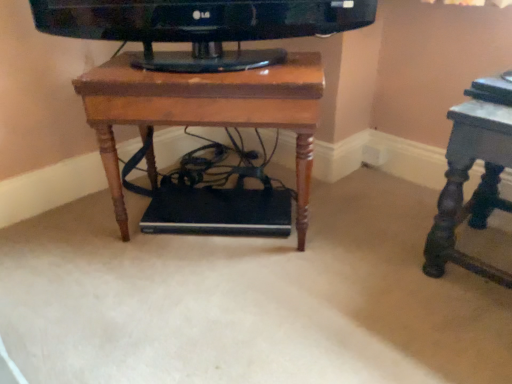
You are a GUI agent. You are given a task and a screenshot of the screen. Output one action in this format:
    pyautogui.click(x=<x>, y=<y>)
    Task: Click on the dark gray polished wood table at right, positioned as the first table in right-to-left order
    This screenshot has width=512, height=384.
    Given the screenshot: What is the action you would take?
    pyautogui.click(x=477, y=187)

What do you see at coordinates (477, 187) in the screenshot? I see `dark gray polished wood table at right, which is counted as the second table, starting from the left` at bounding box center [477, 187].

This screenshot has width=512, height=384. What do you see at coordinates (205, 110) in the screenshot?
I see `wooden table at center, arranged as the first table when viewed from the left` at bounding box center [205, 110].

You are a GUI agent. You are given a task and a screenshot of the screen. Output one action in this format:
    pyautogui.click(x=<x>, y=<y>)
    Task: Click on the wooden table at center, arranged as the 2th table when viewed from the right
    
    Given the screenshot: What is the action you would take?
    205,110

Find the location of a particular element. dark gray polished wood table at right, which is counted as the second table, starting from the left is located at coordinates (477, 187).

Considering the relative positions of wooden table at center, arranged as the first table when viewed from the left, and dark gray polished wood table at right, which is counted as the second table, starting from the left, in the image provided, is wooden table at center, arranged as the first table when viewed from the left, to the left or to the right of dark gray polished wood table at right, which is counted as the second table, starting from the left,?

wooden table at center, arranged as the first table when viewed from the left, is to the left of dark gray polished wood table at right, which is counted as the second table, starting from the left.

Considering the relative positions of wooden table at center, arranged as the 2th table when viewed from the right, and dark gray polished wood table at right, which is counted as the second table, starting from the left, in the image provided, is wooden table at center, arranged as the 2th table when viewed from the right, in front of dark gray polished wood table at right, which is counted as the second table, starting from the left,?

No, wooden table at center, arranged as the 2th table when viewed from the right, is further to the viewer.

Is point (309, 153) closer or farther from the camera than point (462, 161)?

Clearly, point (309, 153) is more distant from the camera than point (462, 161).

From the image's perspective, is wooden table at center, arranged as the first table when viewed from the left, above or below dark gray polished wood table at right, positioned as the first table in right-to-left order?

Based on their image positions, wooden table at center, arranged as the first table when viewed from the left, is located above dark gray polished wood table at right, positioned as the first table in right-to-left order.

From a real-world perspective, which is physically above, wooden table at center, arranged as the 2th table when viewed from the right, or dark gray polished wood table at right, which is counted as the second table, starting from the left?

wooden table at center, arranged as the 2th table when viewed from the right.

Can you confirm if wooden table at center, arranged as the 2th table when viewed from the right, is thinner than dark gray polished wood table at right, which is counted as the second table, starting from the left?

Incorrect, the width of wooden table at center, arranged as the 2th table when viewed from the right, is not less than that of dark gray polished wood table at right, which is counted as the second table, starting from the left.

Does wooden table at center, arranged as the 2th table when viewed from the right, have a lesser height compared to dark gray polished wood table at right, which is counted as the second table, starting from the left?

In fact, wooden table at center, arranged as the 2th table when viewed from the right, may be taller than dark gray polished wood table at right, which is counted as the second table, starting from the left.

Who is bigger, wooden table at center, arranged as the first table when viewed from the left, or dark gray polished wood table at right, positioned as the first table in right-to-left order?

Bigger between the two is wooden table at center, arranged as the first table when viewed from the left.

Is wooden table at center, arranged as the 2th table when viewed from the right, spatially inside dark gray polished wood table at right, which is counted as the second table, starting from the left, or outside of it?

wooden table at center, arranged as the 2th table when viewed from the right, is not enclosed by dark gray polished wood table at right, which is counted as the second table, starting from the left.

Would you say wooden table at center, arranged as the 2th table when viewed from the right, is a long distance from dark gray polished wood table at right, positioned as the first table in right-to-left order?

No, wooden table at center, arranged as the 2th table when viewed from the right, is not far away from dark gray polished wood table at right, positioned as the first table in right-to-left order.

Does wooden table at center, arranged as the first table when viewed from the left, turn towards dark gray polished wood table at right, which is counted as the second table, starting from the left?

No, wooden table at center, arranged as the first table when viewed from the left, is not turned towards dark gray polished wood table at right, which is counted as the second table, starting from the left.

How distant is wooden table at center, arranged as the first table when viewed from the left, from dark gray polished wood table at right, positioned as the first table in right-to-left order?

wooden table at center, arranged as the first table when viewed from the left, is 18.65 inches from dark gray polished wood table at right, positioned as the first table in right-to-left order.

Locate an element on the screen. Image resolution: width=512 pixels, height=384 pixels. table behind the dark gray polished wood table at right, which is counted as the second table, starting from the left is located at coordinates (205, 110).

Does dark gray polished wood table at right, positioned as the first table in right-to-left order, appear on the left side of wooden table at center, arranged as the first table when viewed from the left?

Incorrect, dark gray polished wood table at right, positioned as the first table in right-to-left order, is not on the left side of wooden table at center, arranged as the first table when viewed from the left.

In the image, is dark gray polished wood table at right, which is counted as the second table, starting from the left, positioned in front of or behind wooden table at center, arranged as the 2th table when viewed from the right?

Visually, dark gray polished wood table at right, which is counted as the second table, starting from the left, is located in front of wooden table at center, arranged as the 2th table when viewed from the right.

Does point (436, 266) appear closer or farther from the camera than point (273, 85)?

Clearly, point (436, 266) is more distant from the camera than point (273, 85).

From the image's perspective, is dark gray polished wood table at right, positioned as the first table in right-to-left order, located beneath wooden table at center, arranged as the first table when viewed from the left?

Yes, from the image's perspective, dark gray polished wood table at right, positioned as the first table in right-to-left order, is beneath wooden table at center, arranged as the first table when viewed from the left.

From a real-world perspective, is dark gray polished wood table at right, which is counted as the second table, starting from the left, located beneath wooden table at center, arranged as the first table when viewed from the left?

Correct, in the physical world, dark gray polished wood table at right, which is counted as the second table, starting from the left, is lower than wooden table at center, arranged as the first table when viewed from the left.

Considering the relative sizes of dark gray polished wood table at right, which is counted as the second table, starting from the left, and wooden table at center, arranged as the 2th table when viewed from the right, in the image provided, is dark gray polished wood table at right, which is counted as the second table, starting from the left, thinner than wooden table at center, arranged as the 2th table when viewed from the right,?

Yes, dark gray polished wood table at right, which is counted as the second table, starting from the left, is thinner than wooden table at center, arranged as the 2th table when viewed from the right.

Can you confirm if dark gray polished wood table at right, positioned as the first table in right-to-left order, is shorter than wooden table at center, arranged as the first table when viewed from the left?

Result: Yes.

Consider the image. In terms of size, does dark gray polished wood table at right, positioned as the first table in right-to-left order, appear bigger or smaller than wooden table at center, arranged as the 2th table when viewed from the right?

Clearly, dark gray polished wood table at right, positioned as the first table in right-to-left order, is smaller in size than wooden table at center, arranged as the 2th table when viewed from the right.

Would you say dark gray polished wood table at right, positioned as the first table in right-to-left order, is outside wooden table at center, arranged as the 2th table when viewed from the right?

Yes, dark gray polished wood table at right, positioned as the first table in right-to-left order, is outside of wooden table at center, arranged as the 2th table when viewed from the right.

Are dark gray polished wood table at right, which is counted as the second table, starting from the left, and wooden table at center, arranged as the first table when viewed from the left, making contact?

No.

Is dark gray polished wood table at right, positioned as the first table in right-to-left order, aimed at wooden table at center, arranged as the 2th table when viewed from the right?

No.

Looking at this image, how much distance is there between dark gray polished wood table at right, positioned as the first table in right-to-left order, and wooden table at center, arranged as the first table when viewed from the left?

The distance of dark gray polished wood table at right, positioned as the first table in right-to-left order, from wooden table at center, arranged as the first table when viewed from the left, is 18.65 inches.

The height and width of the screenshot is (384, 512). I want to click on table in front of the wooden table at center, arranged as the first table when viewed from the left, so click(477, 187).

This screenshot has height=384, width=512. Find the location of `table that is in front of the wooden table at center, arranged as the first table when viewed from the left`. table that is in front of the wooden table at center, arranged as the first table when viewed from the left is located at coordinates (477, 187).

Where is `table located underneath the wooden table at center, arranged as the 2th table when viewed from the right (from a real-world perspective)`? The width and height of the screenshot is (512, 384). table located underneath the wooden table at center, arranged as the 2th table when viewed from the right (from a real-world perspective) is located at coordinates (477, 187).